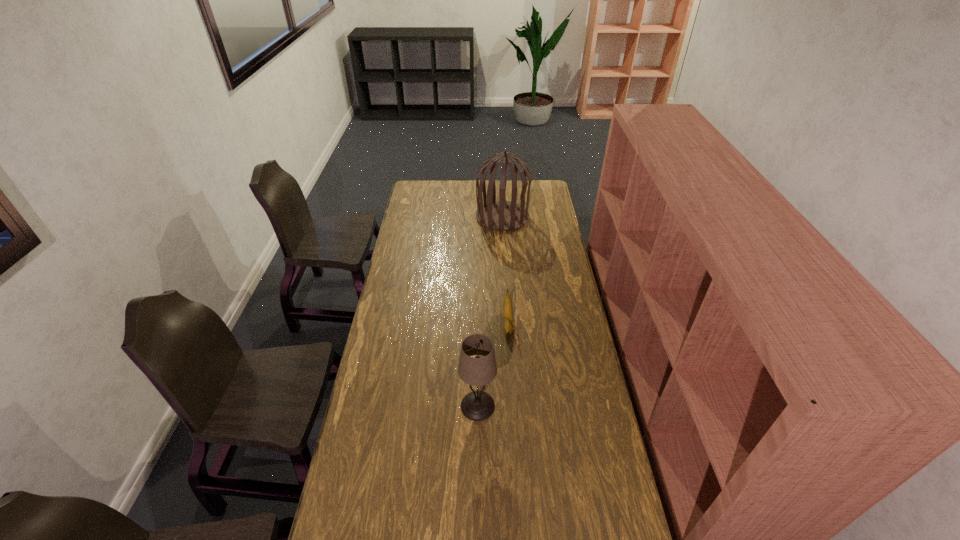
The image size is (960, 540). In order to click on the farthest object in this screenshot , I will do `click(502, 215)`.

Where is `the tallest object`? the tallest object is located at coordinates (502, 215).

The width and height of the screenshot is (960, 540). Find the location of `the second tallest object`. the second tallest object is located at coordinates (477, 405).

Locate an element on the screen. Image resolution: width=960 pixels, height=540 pixels. lampshade is located at coordinates 477,405.

Image resolution: width=960 pixels, height=540 pixels. Find the location of `banana`. banana is located at coordinates (507, 304).

Find the location of `the second farthest object`. the second farthest object is located at coordinates (x=507, y=304).

Where is `blank space located on the front of the birdcage`? The height and width of the screenshot is (540, 960). blank space located on the front of the birdcage is located at coordinates tap(505, 255).

You are a GUI agent. You are given a task and a screenshot of the screen. Output one action in this format:
    pyautogui.click(x=<x>, y=<y>)
    Task: Click on the vacant space located 0.220m on the front-facing side of the second tallest object
    Image resolution: width=960 pixels, height=540 pixels.
    Given the screenshot: What is the action you would take?
    pyautogui.click(x=557, y=406)

Find the location of `vacant region located at the start of the peel on the shortest object`. vacant region located at the start of the peel on the shortest object is located at coordinates (512, 381).

Locate an element on the screen. This screenshot has width=960, height=540. object situated at the right edge is located at coordinates (502, 215).